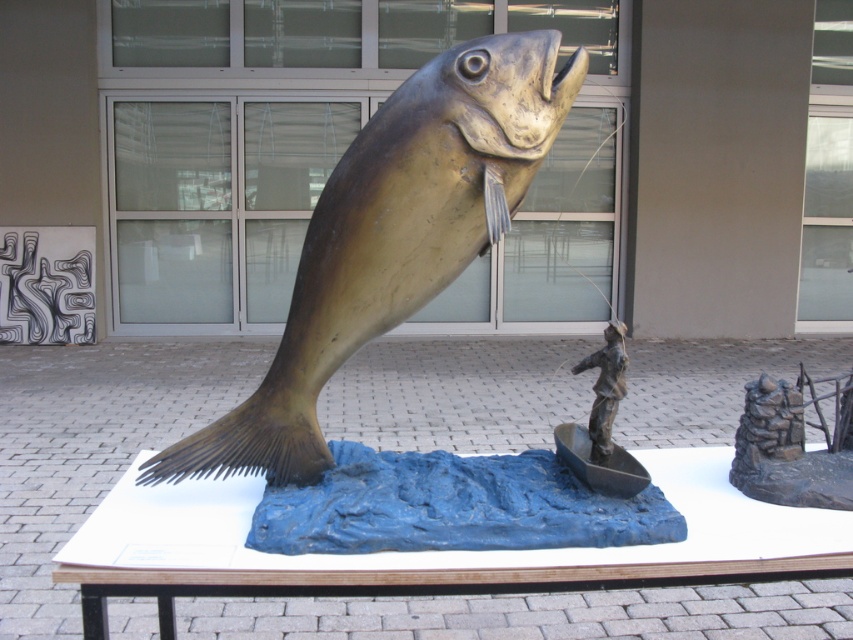
Who is lower down, rustic stone wall at center or bronze fisherman in boat at center?

Positioned lower is rustic stone wall at center.

Between rustic stone wall at center and bronze fisherman in boat at center, which one appears on the left side from the viewer's perspective?

From the viewer's perspective, bronze fisherman in boat at center appears more on the left side.

Who is more forward, (743, 474) or (579, 364)?

Point (579, 364)

At what (x,y) coordinates should I click in order to perform the action: click on rustic stone wall at center. Please return your answer as a coordinate pair (x, y). Looking at the image, I should click on (792, 445).

Is gold-bronze fish at center smaller than bronze fisherman in boat at center?

Incorrect, gold-bronze fish at center is not smaller in size than bronze fisherman in boat at center.

Locate an element on the screen. The image size is (853, 640). gold-bronze fish at center is located at coordinates (392, 237).

Which is above, gold-bronze fish at center or rustic stone wall at center?

Positioned higher is gold-bronze fish at center.

How far apart are gold-bronze fish at center and rustic stone wall at center?

89.33 centimeters

You are a GUI agent. You are given a task and a screenshot of the screen. Output one action in this format:
    pyautogui.click(x=<x>, y=<y>)
    Task: Click on the gold-bronze fish at center
    The image size is (853, 640).
    Given the screenshot: What is the action you would take?
    pyautogui.click(x=392, y=237)